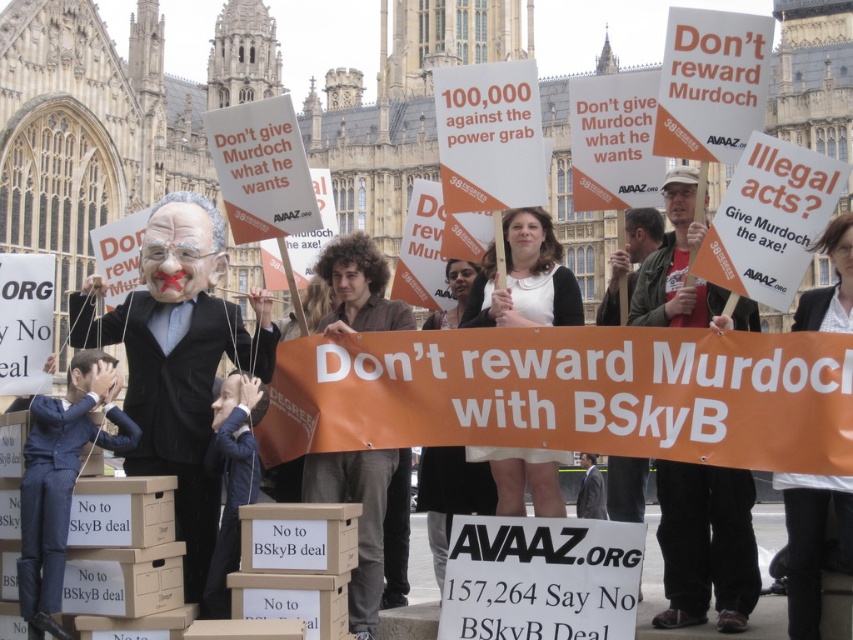
You are a photographer standing at the camera position. You want to capture a closeup of the blue textured suit at center without moving closer than 130 feet. Is this possible?

The blue textured suit at center is 135.30 feet away from the camera. Since the minimum distance you can stay is 130 feet, you can capture the closeup without moving closer than 130 feet.